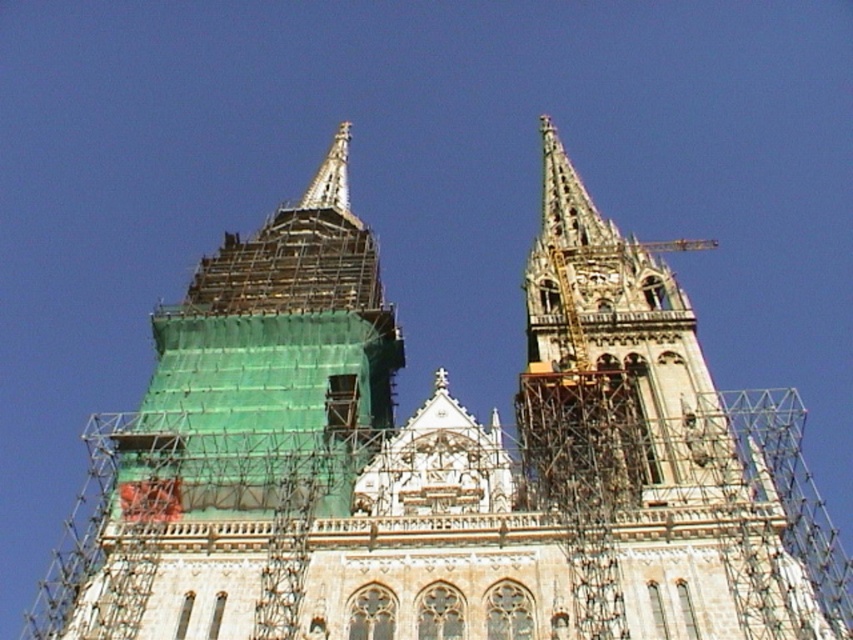
Consider the image. Does stone spire at upper center have a lesser height compared to silver metallic spire at upper center?

No.

Does stone spire at upper center appear on the left side of silver metallic spire at upper center?

No, stone spire at upper center is not to the left of silver metallic spire at upper center.

Identify the location of stone spire at upper center. This screenshot has width=853, height=640. (645, 417).

You are a GUI agent. You are given a task and a screenshot of the screen. Output one action in this format:
    pyautogui.click(x=<x>, y=<y>)
    Task: Click on the stone spire at upper center
    The width and height of the screenshot is (853, 640).
    Given the screenshot: What is the action you would take?
    pyautogui.click(x=645, y=417)